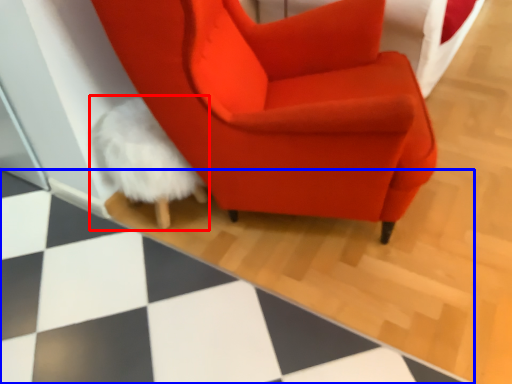
Question: Which object appears closest to the camera in this image, bean bag chair (highlighted by a red box) or tile (highlighted by a blue box)?

Choices:
 (A) bean bag chair
 (B) tile

Answer: (B)